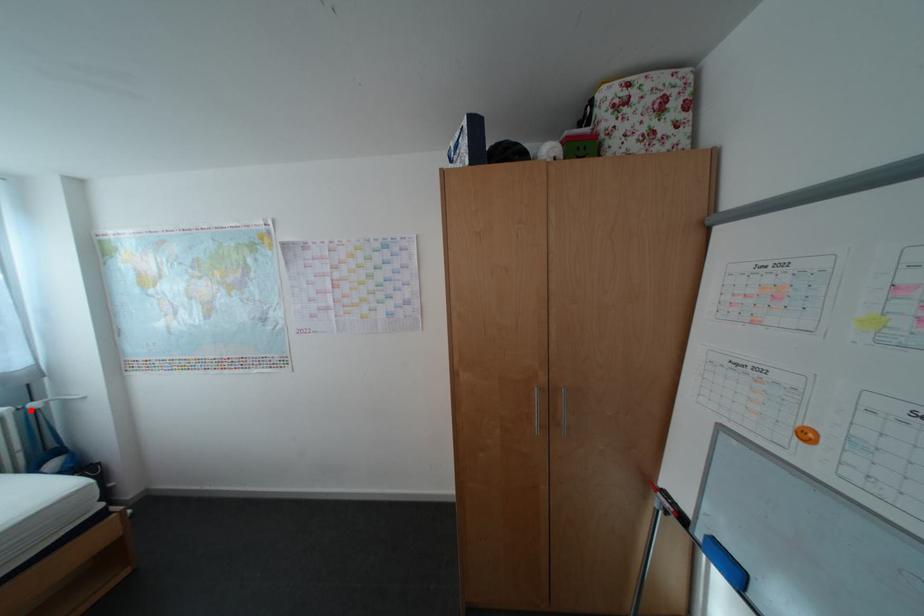
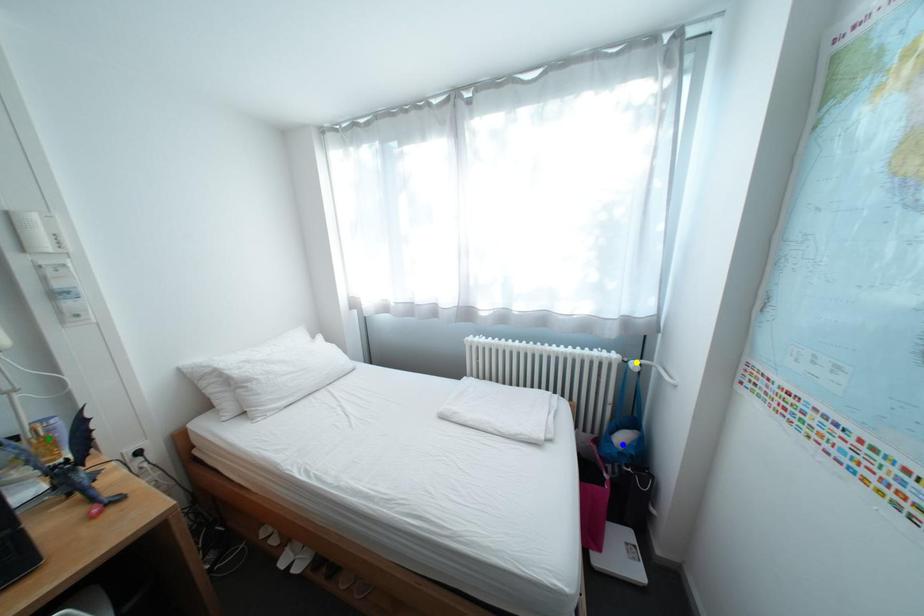
Question: I am providing you with two images of the same scene from different viewpoints. A red point is marked on the first image. You are given multiple points on the second image. Can you choose the point in image 2 that corresponds to the point in image 1?

Choices:
 (A) blue point
 (B) green point
 (C) yellow point

Answer: (C)